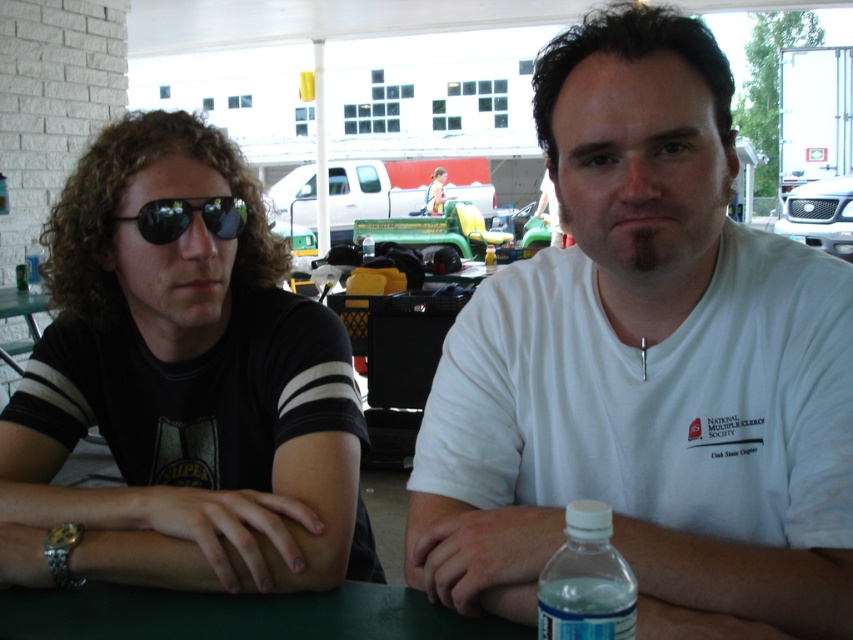
You are a photographer trying to capture a closeup of the white cotton shirt at center and the matte yellow toy car at center. Which object should you focus on first if you want to ensure both are in focus?

The white cotton shirt at center is below the matte yellow toy car at center, so you should focus on the matte yellow toy car at center first to ensure both are in focus.

You are a photographer standing 30 inches away from the white cotton shirt at center. Can you take a clear photo of it without moving closer?

The white cotton shirt at center is 26.45 inches away from the viewer, so you are currently 3.55 inches too far to take a clear photo without moving closer.

You are standing in front of the table where the two individuals are seated. You want to place a new item exactly at the same 2D coordinates as the white cotton shirt at center. What are the coordinates where you should place the new item?

The coordinates to place the new item should be at point (646,368), as that is the 2D location of the white cotton shirt at center.